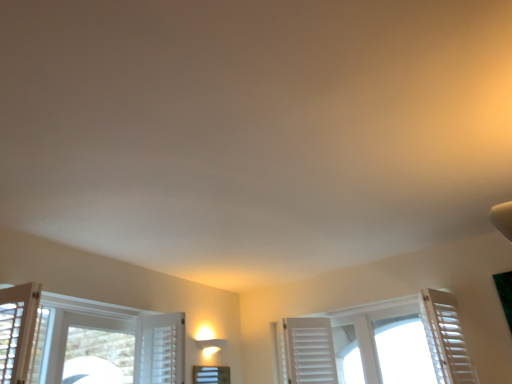
Image resolution: width=512 pixels, height=384 pixels. In order to click on white wooden shutters at center, placed as the 2th window when sorted from left to right in this screenshot , I will do `click(375, 340)`.

Identify the location of white frosted glass window at center, which is counted as the 1th window, starting from the left. The height and width of the screenshot is (384, 512). (211, 375).

Considering the positions of objects white matte shutter at right and white wooden shutters at center, placed as the first window when sorted from right to left, in the image provided, who is in front, white matte shutter at right or white wooden shutters at center, placed as the first window when sorted from right to left,?

white matte shutter at right is in front.

What are the coordinates of `the 1st window below the white matte shutter at right (from the image's perspective)` in the screenshot? It's located at (375, 340).

Is white matte shutter at right facing towards white wooden shutters at center, placed as the 2th window when sorted from left to right?

No, white matte shutter at right does not turn towards white wooden shutters at center, placed as the 2th window when sorted from left to right.

Is white wooden shutters at center, placed as the first window when sorted from right to left, next to white matte shutter at right and touching it?

white wooden shutters at center, placed as the first window when sorted from right to left, and white matte shutter at right are clearly separated.

Looking at this image, is white wooden shutters at center, placed as the 2th window when sorted from left to right, to the left or to the right of white matte shutter at right in the image?

Clearly, white wooden shutters at center, placed as the 2th window when sorted from left to right, is on the left of white matte shutter at right in the image.

From the image's perspective, is white wooden shutters at center, placed as the 2th window when sorted from left to right, over white matte shutter at right?

Actually, white wooden shutters at center, placed as the 2th window when sorted from left to right, appears below white matte shutter at right in the image.

Does white frosted glass window at center, the 2th window when ordered from right to left, have a greater width compared to white matte shutter at right?

No, white frosted glass window at center, the 2th window when ordered from right to left, is not wider than white matte shutter at right.

From the image's perspective, starting from the white matte shutter at right, which window is the 2nd one below? Please provide its 2D coordinates.

[(211, 375)]

Is white frosted glass window at center, the 2th window when ordered from right to left, not close to white matte shutter at right?

Yes, white frosted glass window at center, the 2th window when ordered from right to left, and white matte shutter at right are quite far apart.

Is white matte shutter at right completely or partially inside white frosted glass window at center, the 2th window when ordered from right to left?

No, white matte shutter at right is not a part of white frosted glass window at center, the 2th window when ordered from right to left.

Does point (347, 315) come behind point (196, 369)?

Yes, point (347, 315) is farther from viewer.

Consider the image. Is white wooden shutters at center, placed as the 2th window when sorted from left to right, wider or thinner than white frosted glass window at center, which is counted as the 1th window, starting from the left?

white wooden shutters at center, placed as the 2th window when sorted from left to right, is wider than white frosted glass window at center, which is counted as the 1th window, starting from the left.

Is white wooden shutters at center, placed as the 2th window when sorted from left to right, in front of or behind white frosted glass window at center, the 2th window when ordered from right to left, in the image?

white wooden shutters at center, placed as the 2th window when sorted from left to right, is positioned closer to the viewer than white frosted glass window at center, the 2th window when ordered from right to left.

Is white matte shutter at right to the left of white frosted glass window at center, which is counted as the 1th window, starting from the left, from the viewer's perspective?

No.

Is white matte shutter at right inside the boundaries of white frosted glass window at center, which is counted as the 1th window, starting from the left, or outside?

white matte shutter at right is located beyond the bounds of white frosted glass window at center, which is counted as the 1th window, starting from the left.

Is white matte shutter at right turned away from white frosted glass window at center, the 2th window when ordered from right to left?

white matte shutter at right is not turned away from white frosted glass window at center, the 2th window when ordered from right to left.

Which of these two, white matte shutter at right or white frosted glass window at center, the 2th window when ordered from right to left, stands taller?

white matte shutter at right.

What's the angular difference between white frosted glass window at center, the 2th window when ordered from right to left, and white wooden shutters at center, placed as the first window when sorted from right to left,'s facing directions?

The angular difference between white frosted glass window at center, the 2th window when ordered from right to left, and white wooden shutters at center, placed as the first window when sorted from right to left, is 90.5 degrees.

Can you confirm if white frosted glass window at center, which is counted as the 1th window, starting from the left, is wider than white wooden shutters at center, placed as the 2th window when sorted from left to right?

In fact, white frosted glass window at center, which is counted as the 1th window, starting from the left, might be narrower than white wooden shutters at center, placed as the 2th window when sorted from left to right.

Which of these two, white frosted glass window at center, which is counted as the 1th window, starting from the left, or white wooden shutters at center, placed as the 2th window when sorted from left to right, stands taller?

Standing taller between the two is white wooden shutters at center, placed as the 2th window when sorted from left to right.

I want to click on window on the right of white frosted glass window at center, which is counted as the 1th window, starting from the left, so click(375, 340).

Locate an element on the screen. curtain located on the right of white wooden shutters at center, placed as the 2th window when sorted from left to right is located at coordinates pos(446,338).

At what (x,y) coordinates should I click in order to perform the action: click on curtain that appears above the white wooden shutters at center, placed as the first window when sorted from right to left (from the image's perspective). Please return your answer as a coordinate pair (x, y). The image size is (512, 384). Looking at the image, I should click on (446, 338).

Estimate the real-world distances between objects in this image. Which object is closer to white matte shutter at right, white wooden shutters at center, placed as the 2th window when sorted from left to right, or white frosted glass window at center, which is counted as the 1th window, starting from the left?

white wooden shutters at center, placed as the 2th window when sorted from left to right, is positioned closer to the anchor white matte shutter at right.

Looking at the image, which one is located further to white frosted glass window at center, which is counted as the 1th window, starting from the left, white matte shutter at right or white wooden shutters at center, placed as the 2th window when sorted from left to right?

white matte shutter at right is further to white frosted glass window at center, which is counted as the 1th window, starting from the left.

Which object lies nearer to the anchor point white frosted glass window at center, which is counted as the 1th window, starting from the left, white wooden shutters at center, placed as the first window when sorted from right to left, or white matte shutter at right?

The object closer to white frosted glass window at center, which is counted as the 1th window, starting from the left, is white wooden shutters at center, placed as the first window when sorted from right to left.

From the image, which object appears to be nearer to white matte shutter at right, white frosted glass window at center, which is counted as the 1th window, starting from the left, or white wooden shutters at center, placed as the first window when sorted from right to left?

white wooden shutters at center, placed as the first window when sorted from right to left, lies closer to white matte shutter at right than the other object.

Which object lies further to the anchor point white wooden shutters at center, placed as the 2th window when sorted from left to right, white frosted glass window at center, which is counted as the 1th window, starting from the left, or white matte shutter at right?

white frosted glass window at center, which is counted as the 1th window, starting from the left.

From the image, which object appears to be farther from white wooden shutters at center, placed as the first window when sorted from right to left, white matte shutter at right or white frosted glass window at center, which is counted as the 1th window, starting from the left?

Based on the image, white frosted glass window at center, which is counted as the 1th window, starting from the left, appears to be further to white wooden shutters at center, placed as the first window when sorted from right to left.

Identify the location of window between white frosted glass window at center, the 2th window when ordered from right to left, and white matte shutter at right. This screenshot has height=384, width=512. (375, 340).